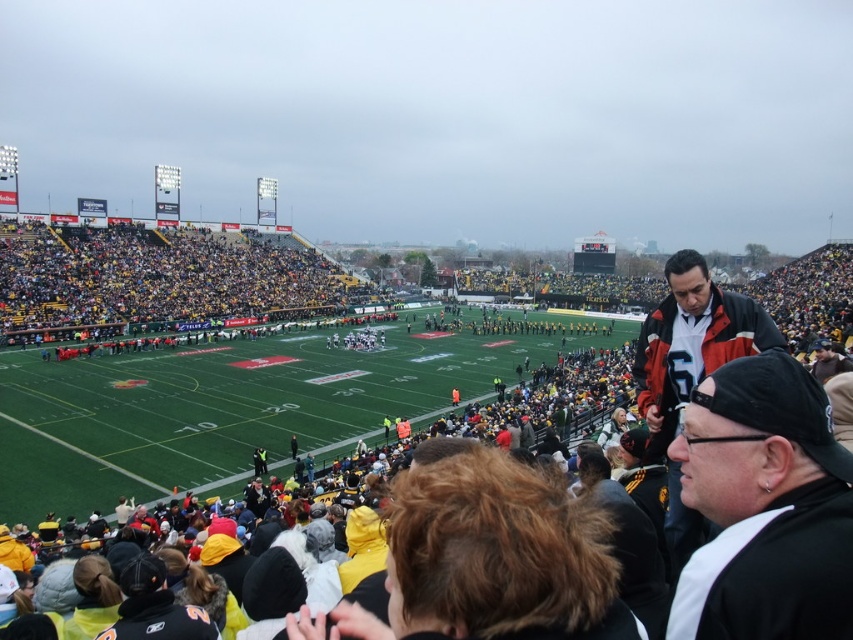
You are a photographer at the stadium and want to capture a photo of the black matte cap at upper right and the matte black jacket at center. Which object should you zoom in on to focus on the taller one?

The matte black jacket at center is taller than the black matte cap at upper right, so you should zoom in on the matte black jacket at center to focus on the taller one.

Looking at this image, you are a photographer at the stadium and want to capture a photo of the black matte cap at upper right and the matte black jacket at center. Since you have a camera with a fixed zoom, you need to know which object is narrower to frame them properly. Which one is narrower?

The black matte cap at upper right is narrower than the matte black jacket at center because its width is less than the jacket.

You are a photographer at the stadium and want to take a photo that includes both the black matte cap at upper right and the matte black jacket at center. Which object should you adjust your camera to focus on first to ensure both are in frame?

You should focus on the matte black jacket at center first since the black matte cap at upper right is to the left of it, ensuring both are within the camera frame.